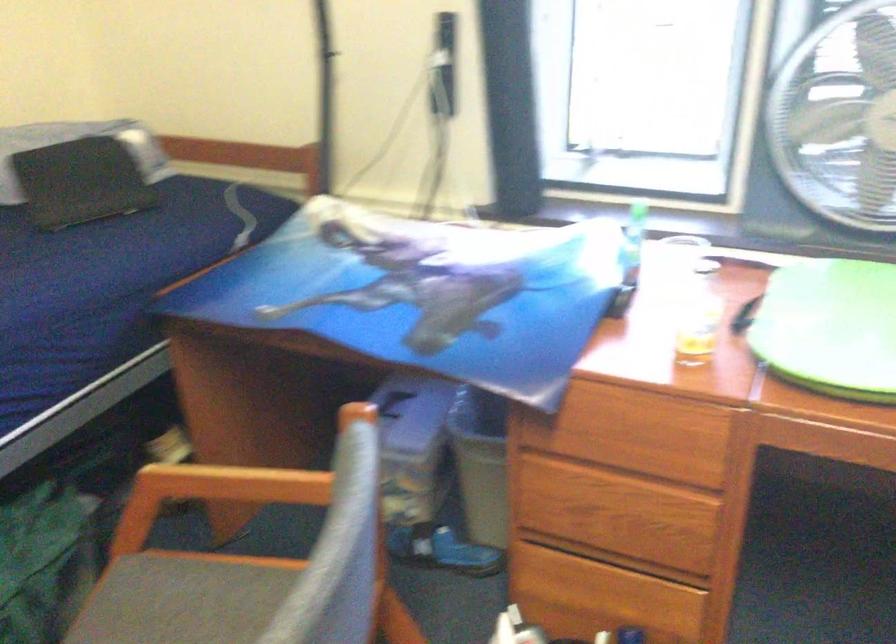
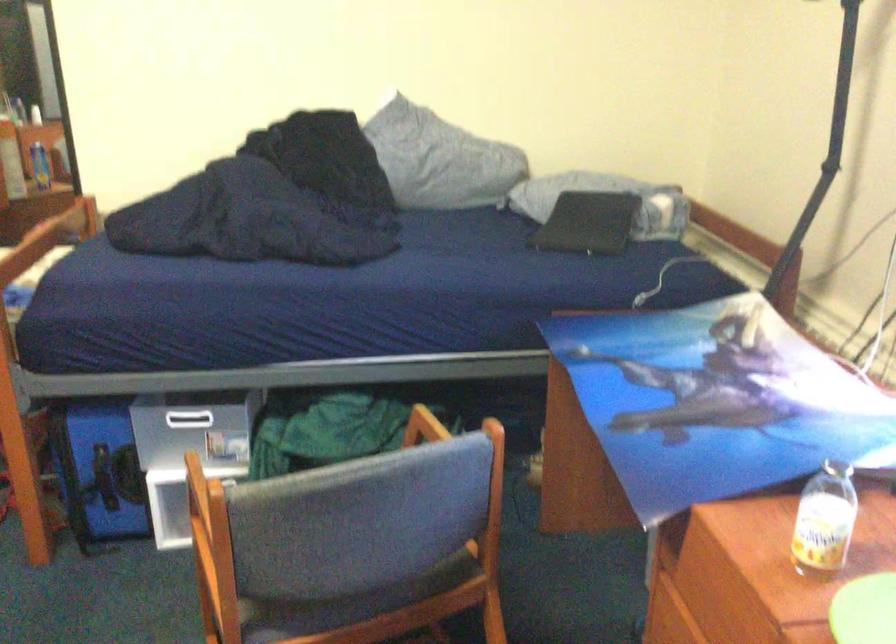
Question: The camera is either moving clockwise (left) or counter-clockwise (right) around the object. The first image is from the beginning of the video and the second image is from the end. Is the camera moving left or right when shooting the video?

Choices:
 (A) Left
 (B) Right

Answer: (B)